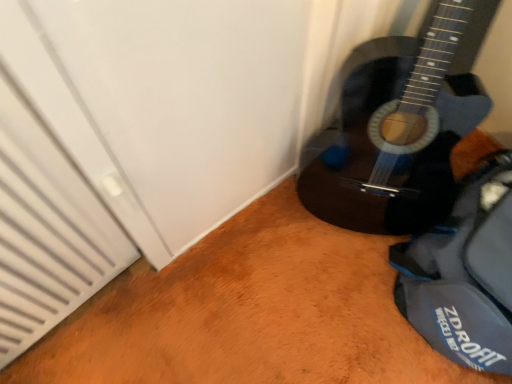
Question: Considering the relative sizes of blue fabric messenger bag at lower right and glossy dark wood guitar at lower right in the image provided, is blue fabric messenger bag at lower right taller than glossy dark wood guitar at lower right?

Choices:
 (A) no
 (B) yes

Answer: (A)

Question: Is blue fabric messenger bag at lower right thinner than glossy dark wood guitar at lower right?

Choices:
 (A) no
 (B) yes

Answer: (A)

Question: Is blue fabric messenger bag at lower right completely or partially outside of glossy dark wood guitar at lower right?

Choices:
 (A) yes
 (B) no

Answer: (A)

Question: Could you tell me if blue fabric messenger bag at lower right is turned towards glossy dark wood guitar at lower right?

Choices:
 (A) no
 (B) yes

Answer: (A)

Question: From the image's perspective, is blue fabric messenger bag at lower right on top of glossy dark wood guitar at lower right?

Choices:
 (A) no
 (B) yes

Answer: (A)

Question: Would you say glossy dark wood guitar at lower right is part of blue fabric messenger bag at lower right's contents?

Choices:
 (A) no
 (B) yes

Answer: (A)

Question: Is glossy dark wood guitar at lower right shorter than blue fabric messenger bag at lower right?

Choices:
 (A) no
 (B) yes

Answer: (A)

Question: Are glossy dark wood guitar at lower right and blue fabric messenger bag at lower right beside each other?

Choices:
 (A) yes
 (B) no

Answer: (B)

Question: Is glossy dark wood guitar at lower right smaller than blue fabric messenger bag at lower right?

Choices:
 (A) no
 (B) yes

Answer: (A)

Question: Is glossy dark wood guitar at lower right at the left side of blue fabric messenger bag at lower right?

Choices:
 (A) no
 (B) yes

Answer: (B)

Question: Is glossy dark wood guitar at lower right facing away from blue fabric messenger bag at lower right?

Choices:
 (A) no
 (B) yes

Answer: (A)

Question: Is glossy dark wood guitar at lower right to the right of blue fabric messenger bag at lower right from the viewer's perspective?

Choices:
 (A) no
 (B) yes

Answer: (A)

Question: From a real-world perspective, is blue fabric messenger bag at lower right positioned above or below glossy dark wood guitar at lower right?

Choices:
 (A) below
 (B) above

Answer: (A)